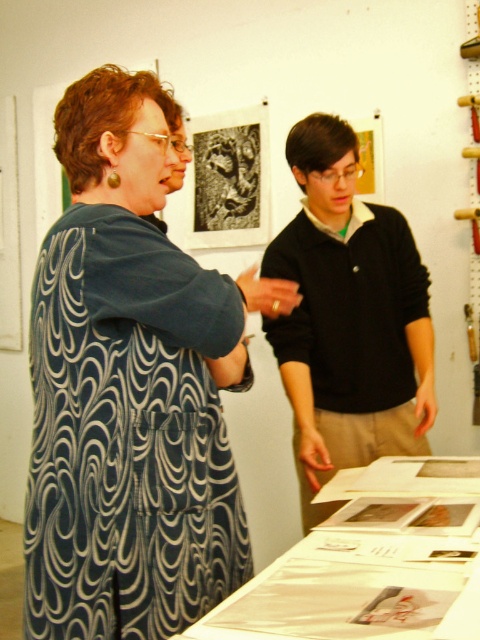
Between blue swirled fabric at center and black sweater at center, which one has less height?

Standing shorter between the two is blue swirled fabric at center.

Who is more forward, [117,144] or [297,400]?

Point [117,144] is in front.

I want to click on blue swirled fabric at center, so click(x=128, y=392).

Does point (301, 465) come in front of point (245, 196)?

That is True.

Can you confirm if black sweater at center is positioned to the left of black stone carving at center?

No, black sweater at center is not to the left of black stone carving at center.

Between point (284, 349) and point (211, 211), which one is positioned in front?

Point (284, 349) is in front.

In order to click on black sweater at center in this screenshot , I will do `click(348, 317)`.

Does point (96, 458) lie behind point (244, 218)?

No, (96, 458) is closer to viewer.

Where is `blue swirled fabric at center`? blue swirled fabric at center is located at coordinates (128, 392).

Between point (183, 598) and point (253, 196), which one is positioned behind?

The point (253, 196) is more distant.

You are a GUI agent. You are given a task and a screenshot of the screen. Output one action in this format:
    pyautogui.click(x=<x>, y=<y>)
    Task: Click on the blue swirled fabric at center
    
    Given the screenshot: What is the action you would take?
    pyautogui.click(x=128, y=392)